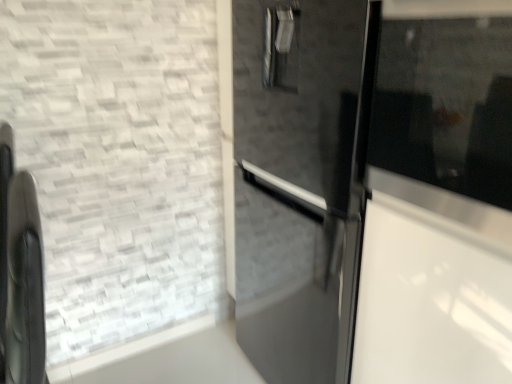
Question: Is black matte chair at left to the left or to the right of transparent glass door at right in the image?

Choices:
 (A) left
 (B) right

Answer: (A)

Question: Looking at the image, does black matte chair at left seem bigger or smaller compared to transparent glass door at right?

Choices:
 (A) small
 (B) big

Answer: (B)

Question: From their relative heights in the image, would you say black matte chair at left is taller or shorter than transparent glass door at right?

Choices:
 (A) short
 (B) tall

Answer: (B)

Question: Considering their positions, is transparent glass door at right located in front of or behind black matte chair at left?

Choices:
 (A) behind
 (B) front

Answer: (B)

Question: From the image's perspective, is transparent glass door at right above or below black matte chair at left?

Choices:
 (A) below
 (B) above

Answer: (B)

Question: Is point (459, 109) closer or farther from the camera than point (28, 269)?

Choices:
 (A) closer
 (B) farther

Answer: (A)

Question: Is transparent glass door at right spatially inside black matte chair at left, or outside of it?

Choices:
 (A) outside
 (B) inside

Answer: (A)